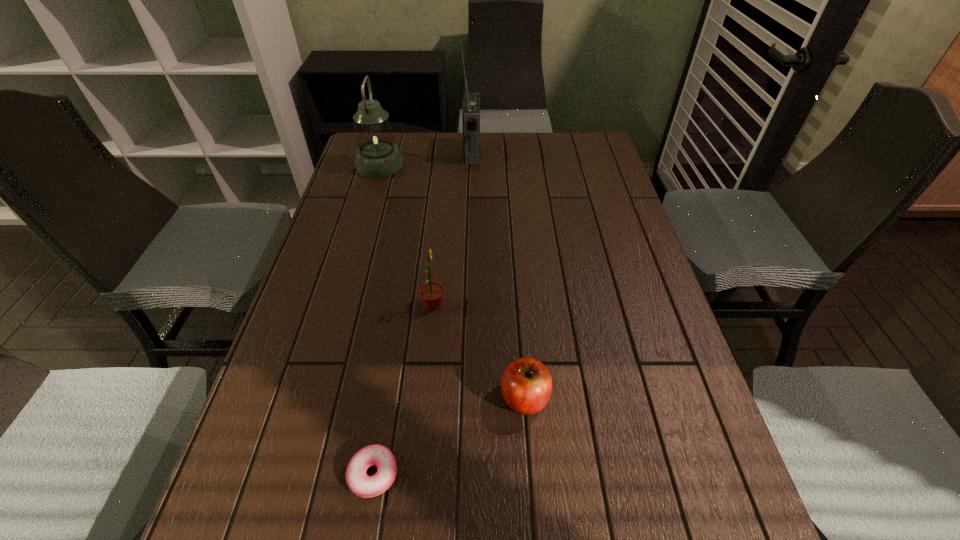
The width and height of the screenshot is (960, 540). In order to click on vacant space located on the display of the tallest object in this screenshot , I will do `click(582, 152)`.

Identify the location of free region located 0.320m on the right of the lantern. The width and height of the screenshot is (960, 540). (497, 165).

At what (x,y) coordinates should I click in order to perform the action: click on vacant space located 0.360m on the face of the third nearest object. Please return your answer as a coordinate pair (x, y). This screenshot has width=960, height=540. Looking at the image, I should click on (594, 305).

What are the coordinates of `blank space located 0.110m on the left of the second nearest object` in the screenshot? It's located at (446, 398).

Where is `vacant space located on the back of the doughnut`? vacant space located on the back of the doughnut is located at coordinates (394, 350).

Image resolution: width=960 pixels, height=540 pixels. Find the location of `radio receiver positioned at the far edge`. radio receiver positioned at the far edge is located at coordinates (471, 101).

Image resolution: width=960 pixels, height=540 pixels. I want to click on lantern that is at the far edge, so click(x=378, y=156).

Find the location of `object that is at the left edge`. object that is at the left edge is located at coordinates (378, 156).

Where is `object located at the far left corner`? This screenshot has width=960, height=540. object located at the far left corner is located at coordinates (378, 156).

I want to click on vacant space at the far edge of the desktop, so click(x=412, y=141).